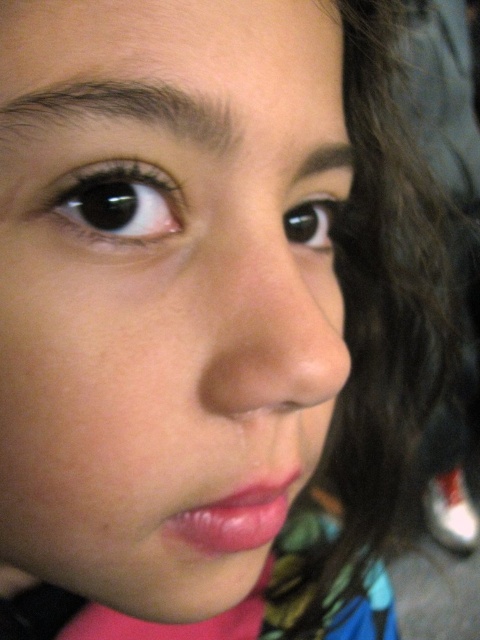
You are a photographer using a camera with a focal length of 50mm. You want to capture a close portrait of the subject while ensuring the dark brown hair at upper left is in focus. Given the camera settings, what is the minimum distance you should maintain to ensure the hair is sharply focused?

The dark brown hair at upper left is positioned 7.42 inches from the camera. To ensure it is in focus, the photographer should maintain a distance of at least 7.42 inches from the subject.

You are a makeup artist preparing to apply lipstick. You need to ensure the lipstick will be visible against the skin tone. Based on the image, will the pink glossy lips at center be easily distinguishable from the smooth skin face at center in terms of height?

The smooth skin face at center is much taller than the pink glossy lips at center, so the lips are smaller in height compared to the face, making them potentially less distinguishable in terms of height.